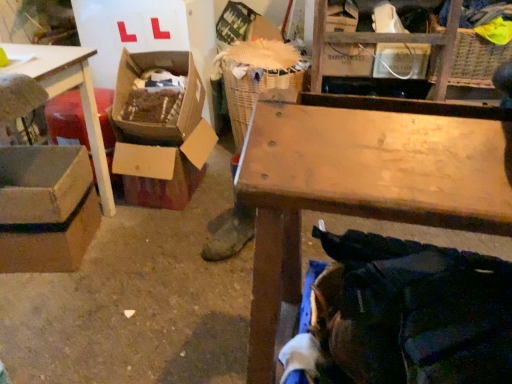
Question: Does cardboard box at left appear on the left side of cardboard box at center-left, the 2th box when ordered from left to right?

Choices:
 (A) yes
 (B) no

Answer: (A)

Question: Is cardboard box at left not near cardboard box at center-left, the 2th box when ordered from left to right?

Choices:
 (A) no
 (B) yes

Answer: (A)

Question: Is cardboard box at left smaller than cardboard box at center-left, the 2th box when ordered from left to right?

Choices:
 (A) yes
 (B) no

Answer: (B)

Question: Is the position of cardboard box at left less distant than that of cardboard box at center-left, marked as the 1th box in a right-to-left arrangement?

Choices:
 (A) yes
 (B) no

Answer: (A)

Question: Does cardboard box at left have a greater height compared to cardboard box at center-left, the 2th box when ordered from left to right?

Choices:
 (A) yes
 (B) no

Answer: (A)

Question: From a real-world perspective, is gray cardboard box at lower left, which is counted as the 2th box, starting from the right, positioned above or below wooden table at center?

Choices:
 (A) above
 (B) below

Answer: (B)

Question: Is gray cardboard box at lower left, which is counted as the 2th box, starting from the right, to the left or to the right of wooden table at center in the image?

Choices:
 (A) right
 (B) left

Answer: (B)

Question: Considering the positions of point (47, 167) and point (289, 221), is point (47, 167) closer or farther from the camera than point (289, 221)?

Choices:
 (A) closer
 (B) farther

Answer: (B)

Question: Looking at their shapes, would you say gray cardboard box at lower left, the first box in the left-to-right sequence, is wider or thinner than wooden table at center?

Choices:
 (A) thin
 (B) wide

Answer: (A)

Question: From the image's perspective, is cardboard box at left above or below woven straw laundry basket at center?

Choices:
 (A) above
 (B) below

Answer: (B)

Question: Is cardboard box at left situated inside woven straw laundry basket at center or outside?

Choices:
 (A) outside
 (B) inside

Answer: (A)

Question: Is cardboard box at left in front of or behind woven straw laundry basket at center in the image?

Choices:
 (A) front
 (B) behind

Answer: (A)

Question: Considering the positions of point (130, 125) and point (252, 102), is point (130, 125) closer or farther from the camera than point (252, 102)?

Choices:
 (A) farther
 (B) closer

Answer: (A)

Question: Is woven straw laundry basket at center inside or outside of gray cardboard box at lower left, which is counted as the 2th box, starting from the right?

Choices:
 (A) inside
 (B) outside

Answer: (B)

Question: Is woven straw laundry basket at center taller or shorter than gray cardboard box at lower left, which is counted as the 2th box, starting from the right?

Choices:
 (A) short
 (B) tall

Answer: (B)